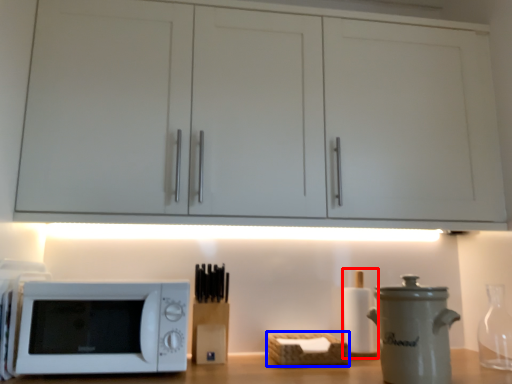
Question: Among these objects, which one is farthest to the camera, bottle (highlighted by a red box) or basket (highlighted by a blue box)?

Choices:
 (A) bottle
 (B) basket

Answer: (A)